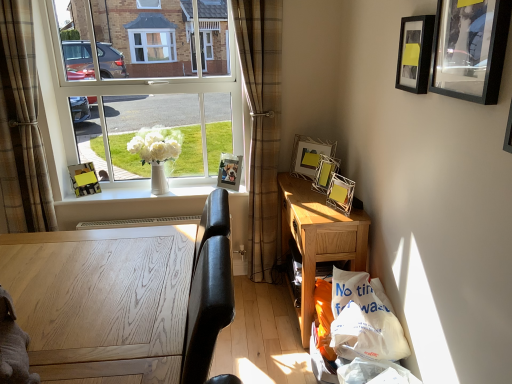
Question: Can you confirm if black matte picture frame at upper right, which is counted as the 2th picture frame, starting from the front, is positioned to the right of white oak desk at lower left, which is the second desk from back to front?

Choices:
 (A) yes
 (B) no

Answer: (A)

Question: Does black matte picture frame at upper right, placed as the 5th picture frame when sorted from back to front, lie in front of white oak desk at lower left, placed as the second desk when sorted from right to left?

Choices:
 (A) yes
 (B) no

Answer: (B)

Question: Considering the relative sizes of black matte picture frame at upper right, which is counted as the 2th picture frame, starting from the front, and white oak desk at lower left, marked as the 1th desk in a left-to-right arrangement, in the image provided, is black matte picture frame at upper right, which is counted as the 2th picture frame, starting from the front, bigger than white oak desk at lower left, marked as the 1th desk in a left-to-right arrangement,?

Choices:
 (A) yes
 (B) no

Answer: (B)

Question: Considering the relative positions of black matte picture frame at upper right, the 5th picture frame positioned from the left, and white oak desk at lower left, the first desk viewed from the front, in the image provided, is black matte picture frame at upper right, the 5th picture frame positioned from the left, behind white oak desk at lower left, the first desk viewed from the front,?

Choices:
 (A) yes
 (B) no

Answer: (A)

Question: From a real-world perspective, is black matte picture frame at upper right, placed as the 5th picture frame when sorted from back to front, below white oak desk at lower left, marked as the 1th desk in a left-to-right arrangement?

Choices:
 (A) yes
 (B) no

Answer: (B)

Question: Is white glossy vase at center spatially inside yellow cardboard picture frame at upper right, the 3th picture frame in the front-to-back sequence, or outside of it?

Choices:
 (A) inside
 (B) outside

Answer: (B)

Question: Does point coord(196,188) appear closer or farther from the camera than point coord(322,168)?

Choices:
 (A) farther
 (B) closer

Answer: (A)

Question: In terms of height, does white glossy vase at center look taller or shorter compared to yellow cardboard picture frame at upper right, arranged as the third picture frame when viewed from the right?

Choices:
 (A) short
 (B) tall

Answer: (A)

Question: From the image's perspective, is white glossy vase at center above or below yellow cardboard picture frame at upper right, arranged as the third picture frame when viewed from the right?

Choices:
 (A) above
 (B) below

Answer: (B)

Question: Is black matte picture frame at upper right, placed as the 5th picture frame when sorted from back to front, inside the boundaries of matte black picture frame at window, the 6th picture frame in the right-to-left sequence, or outside?

Choices:
 (A) outside
 (B) inside

Answer: (A)

Question: Is black matte picture frame at upper right, the 2th picture frame when ordered from right to left, bigger or smaller than matte black picture frame at window, the 1th picture frame in the left-to-right sequence?

Choices:
 (A) small
 (B) big

Answer: (A)

Question: Considering the positions of black matte picture frame at upper right, the 5th picture frame positioned from the left, and matte black picture frame at window, acting as the second picture frame starting from the back, in the image, is black matte picture frame at upper right, the 5th picture frame positioned from the left, wider or thinner than matte black picture frame at window, acting as the second picture frame starting from the back,?

Choices:
 (A) wide
 (B) thin

Answer: (B)

Question: In the image, is black matte picture frame at upper right, which is counted as the 2th picture frame, starting from the front, on the left side or the right side of matte black picture frame at window, acting as the second picture frame starting from the back?

Choices:
 (A) right
 (B) left

Answer: (A)

Question: From the image's perspective, is metallic silver photo frame at upper center, which is the second picture frame from left to right, above or below white glossy vase at center?

Choices:
 (A) below
 (B) above

Answer: (B)

Question: Based on their sizes in the image, would you say metallic silver photo frame at upper center, acting as the 5th picture frame starting from the right, is bigger or smaller than white glossy vase at center?

Choices:
 (A) big
 (B) small

Answer: (B)